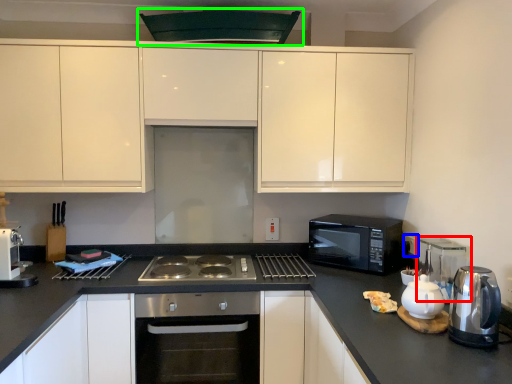
Question: Estimate the real-world distances between objects in this image. Which object is closer to appliance (highlighted by a red box), electric outlet (highlighted by a blue box) or exhaust hood (highlighted by a green box)?

Choices:
 (A) electric outlet
 (B) exhaust hood

Answer: (A)